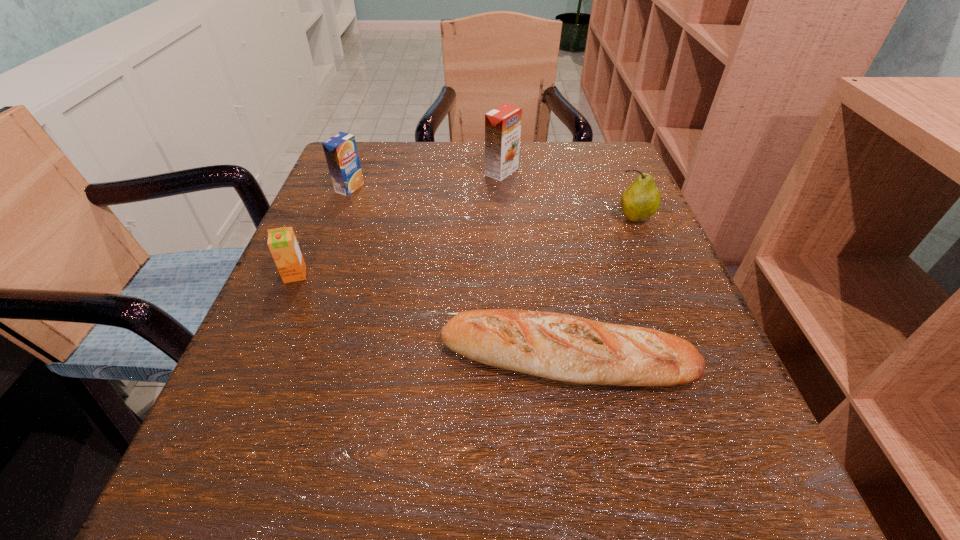
Locate an element on the screen. pear at the right edge is located at coordinates (642, 198).

At what (x,y) coordinates should I click in order to perform the action: click on baguet that is positioned at the right edge. Please return your answer as a coordinate pair (x, y). This screenshot has width=960, height=540. Looking at the image, I should click on (551, 345).

Locate an element on the screen. object located in the far left corner section of the desktop is located at coordinates (340, 150).

In the image, there is a desktop. At what (x,y) coordinates should I click in order to perform the action: click on vacant space at the far edge. Please return your answer as a coordinate pair (x, y). The width and height of the screenshot is (960, 540). Looking at the image, I should click on (525, 174).

Find the location of a particular element. This screenshot has height=540, width=960. blank area at the near edge is located at coordinates (605, 503).

Locate an element on the screen. free space at the left edge is located at coordinates (318, 443).

Where is `vacant space at the right edge of the desktop`? vacant space at the right edge of the desktop is located at coordinates (726, 429).

The width and height of the screenshot is (960, 540). I want to click on vacant region at the far left corner of the desktop, so (381, 163).

Where is `vacant region at the far right corner of the desktop`? This screenshot has width=960, height=540. vacant region at the far right corner of the desktop is located at coordinates (610, 151).

Where is `free space at the near right corner`? free space at the near right corner is located at coordinates (761, 502).